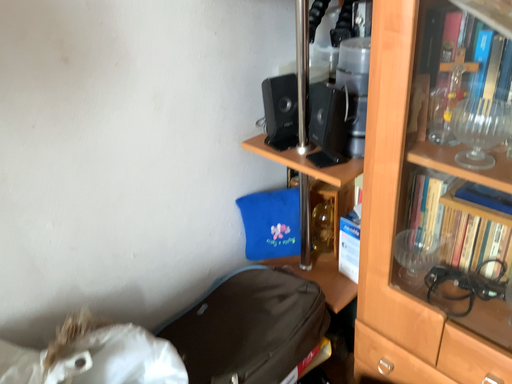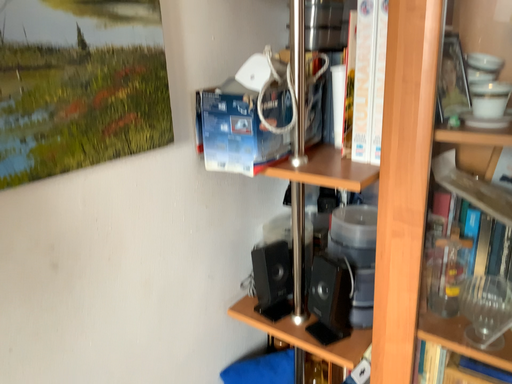
Question: How did the camera likely rotate when shooting the video?

Choices:
 (A) rotated left
 (B) rotated right

Answer: (B)